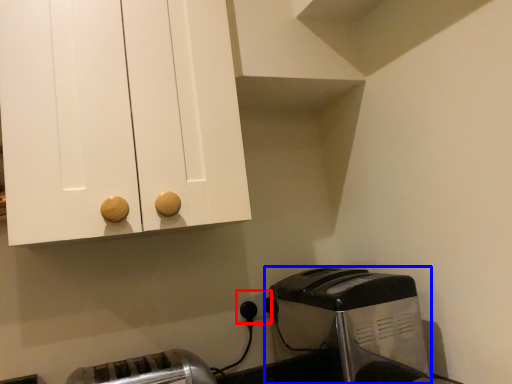
Question: Which object is closer to the camera taking this photo, electric outlet (highlighted by a red box) or toaster (highlighted by a blue box)?

Choices:
 (A) electric outlet
 (B) toaster

Answer: (B)